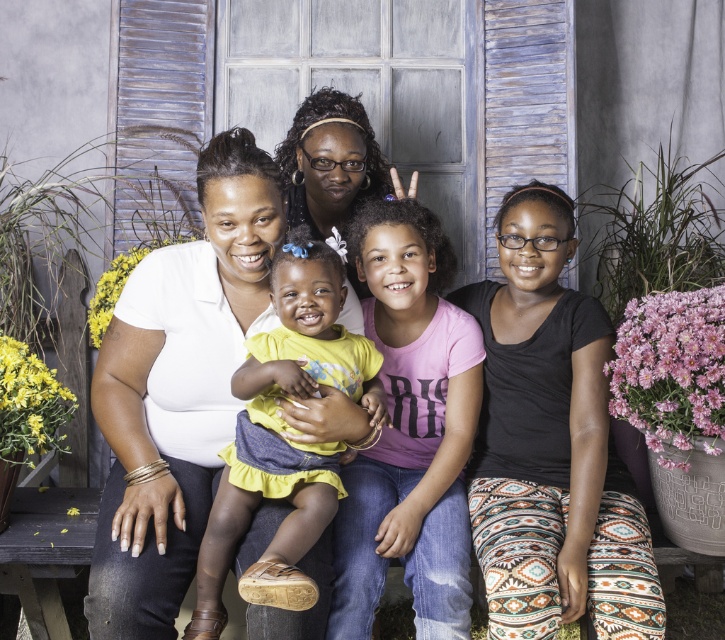
You are standing in front of the group of people in the image. There are two points marked in the scene. The first point is at coordinate location point (406, 314) and the second point is at point (534, 472). Which point is closer to you?

Point (406, 314) is closer to you because it is further to the viewer than point (534, 472).